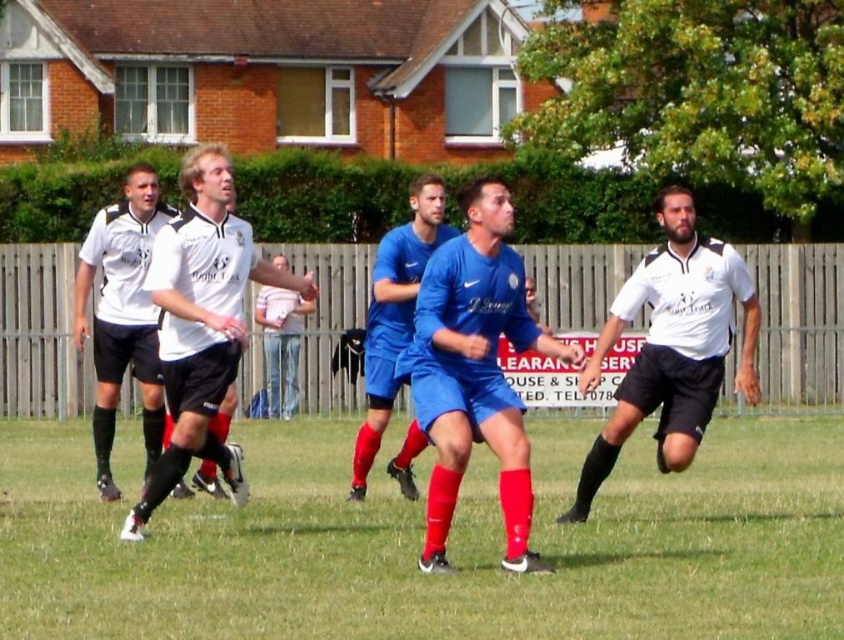
Which is in front, point (550, 433) or point (228, 330)?

Point (228, 330)

Does green grass at center have a lesser height compared to white matte jersey at center?

Yes, green grass at center is shorter than white matte jersey at center.

Is point (637, 502) positioned after point (218, 148)?

Yes.

This screenshot has height=640, width=844. I want to click on green grass at center, so click(448, 545).

Is blue jersey at center bigger than white matte jersey at left?

Correct, blue jersey at center is larger in size than white matte jersey at left.

Who is positioned more to the left, blue jersey at center or white matte jersey at left?

Positioned to the left is white matte jersey at left.

Describe the element at coordinates (475, 369) in the screenshot. I see `blue jersey at center` at that location.

Where is `blue jersey at center`? This screenshot has width=844, height=640. blue jersey at center is located at coordinates (475, 369).

Which is below, white matte jersey at right or white matte jersey at left?

white matte jersey at left is lower down.

Is point (745, 301) more distant than point (134, 268)?

No, it is not.

Locate an element on the screen. This screenshot has width=844, height=640. white matte jersey at right is located at coordinates click(672, 346).